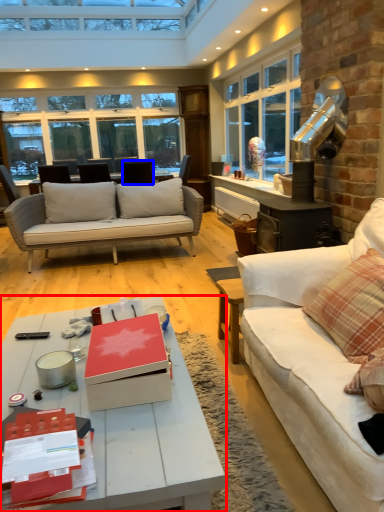
Question: Which of the following is the closest to the observer, coffee table (highlighted by a red box) or chair (highlighted by a blue box)?

Choices:
 (A) coffee table
 (B) chair

Answer: (A)